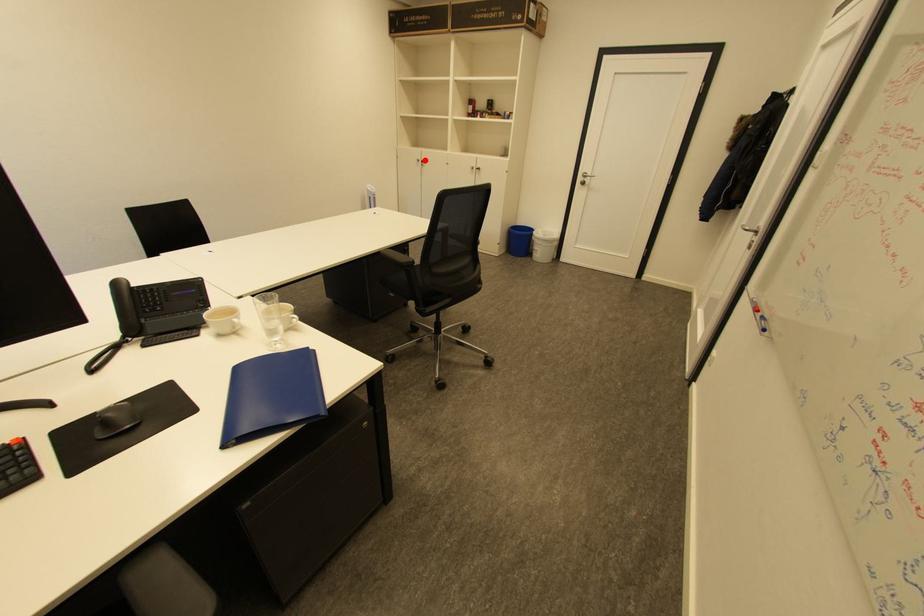
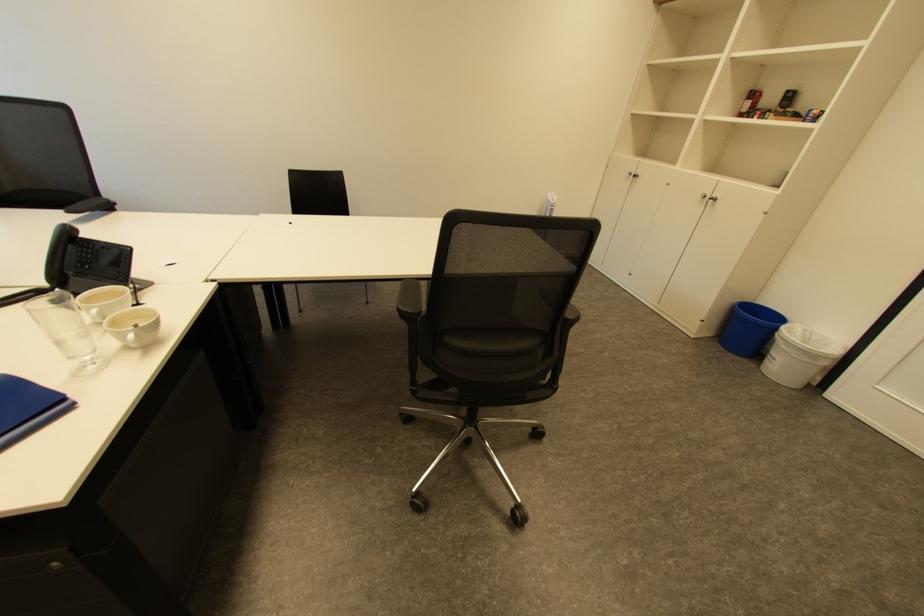
Question: I am providing you with two images of the same scene from different viewpoints. In image1, a red point is highlighted. Considering the same 3D point in image2, which of the following is correct?

Choices:
 (A) It is closer
 (B) It is farther

Answer: (A)